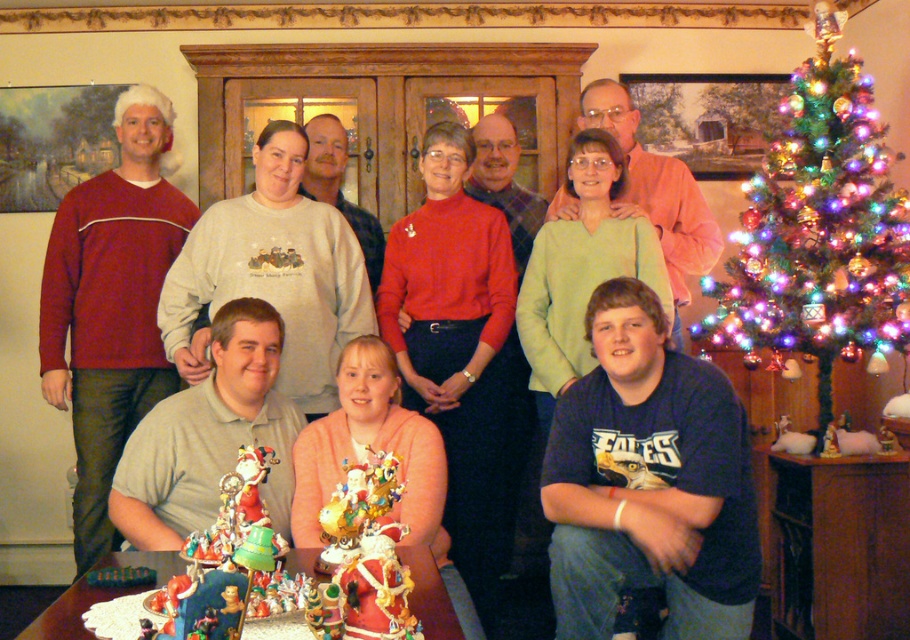
You are a photographer standing at the point marked by the coordinate point at [676,605]. You want to take a photo of the Christmas tree and the group of nine people. However, you need to ensure that the distance between the Christmas tree and the group is exactly 7.36 feet. Is the current arrangement suitable for your photo?

The distance between the Christmas tree and the group of nine people is already 7.36 feet, so the current arrangement is suitable for your photo.